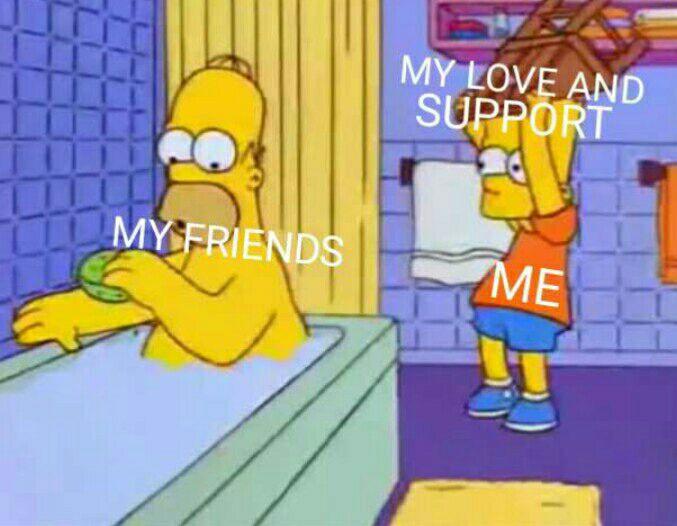
Identify the location of bath. (124, 431).